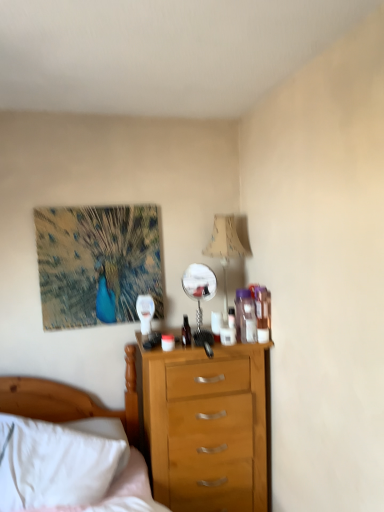
Question: In terms of height, does polished silver mirror at center look taller or shorter compared to textured canvas peacock at upper left?

Choices:
 (A) short
 (B) tall

Answer: (A)

Question: Looking at the image, does polished silver mirror at center seem bigger or smaller compared to textured canvas peacock at upper left?

Choices:
 (A) small
 (B) big

Answer: (A)

Question: Which object is positioned closest to the white soft bed at lower left?

Choices:
 (A) beige fabric lampshade at upper right
 (B) textured canvas peacock at upper left
 (C) polished silver mirror at center

Answer: (B)

Question: Which object is the farthest from the white soft bed at lower left?

Choices:
 (A) beige fabric lampshade at upper right
 (B) polished silver mirror at center
 (C) textured canvas peacock at upper left

Answer: (A)